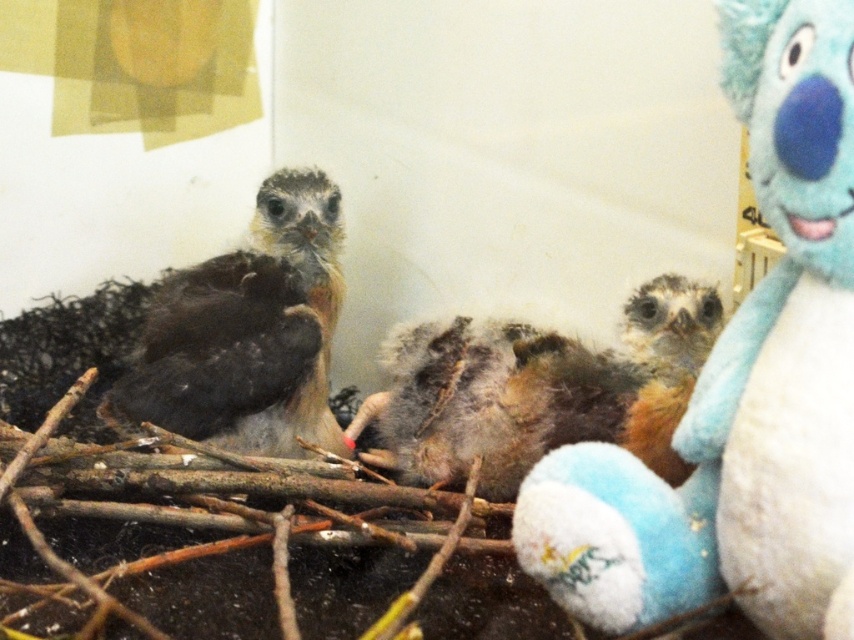
Is fluffy blue plush at right above brown fluffy bird at left?

No.

The image size is (854, 640). Describe the element at coordinates (740, 381) in the screenshot. I see `fluffy blue plush at right` at that location.

Measure the distance between fluffy blue plush at right and camera.

A distance of 63.59 centimeters exists between fluffy blue plush at right and camera.

The height and width of the screenshot is (640, 854). I want to click on fluffy blue plush at right, so pos(740,381).

Measure the distance between fluffy blue plush at right and fuzzy brown bird at center.

A distance of 39.20 centimeters exists between fluffy blue plush at right and fuzzy brown bird at center.

Who is more distant from viewer, [822,236] or [433,426]?

Result: The point [433,426] is more distant.

Find the location of a particular element. fluffy blue plush at right is located at coordinates (740, 381).

You are a GUI agent. You are given a task and a screenshot of the screen. Output one action in this format:
    pyautogui.click(x=<x>, y=<y>)
    Task: Click on the fuzzy brown bird at center
    
    Given the screenshot: What is the action you would take?
    pyautogui.click(x=542, y=390)

Which is below, fuzzy brown bird at center or brown fluffy bird at left?

fuzzy brown bird at center is below.

What do you see at coordinates (542, 390) in the screenshot? The image size is (854, 640). I see `fuzzy brown bird at center` at bounding box center [542, 390].

What are the coordinates of `fuzzy brown bird at center` in the screenshot? It's located at (542, 390).